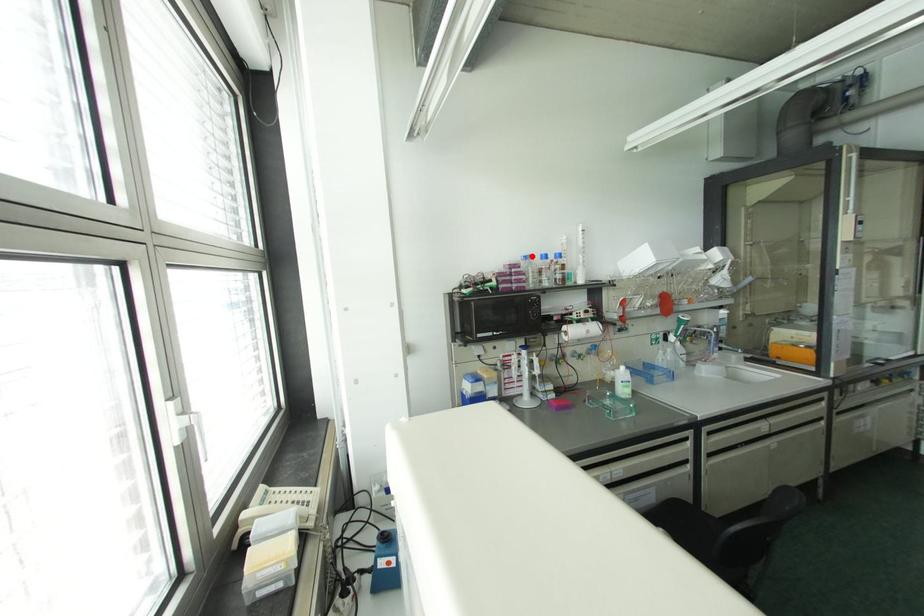
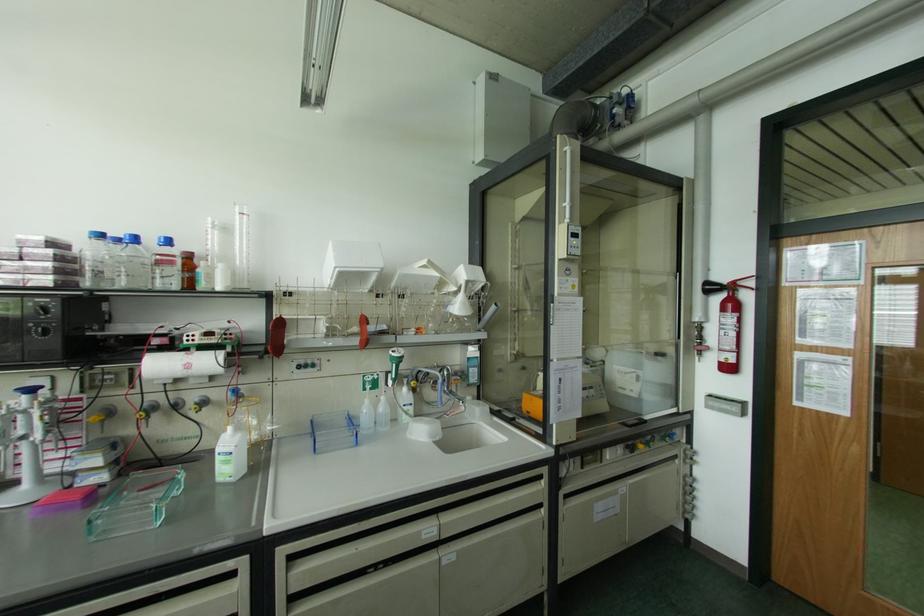
Locate, in the second image, the point that corresponds to the highlighted location in the first image.

(101, 236)